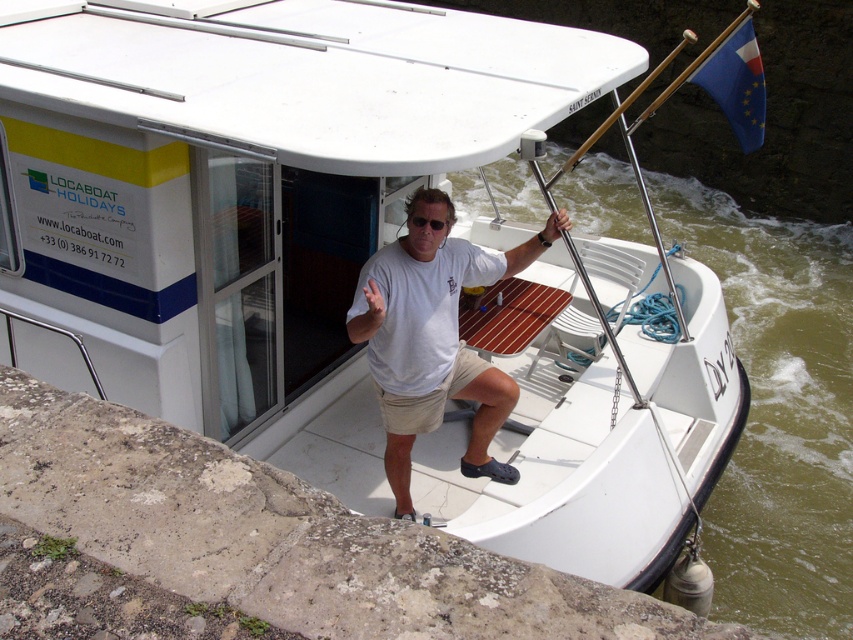
Between stone textured ledge at lower left and white cotton shirt at center, which one has more height?

With more height is white cotton shirt at center.

Can you confirm if stone textured ledge at lower left is positioned above white cotton shirt at center?

Actually, stone textured ledge at lower left is below white cotton shirt at center.

Is point (422, 625) positioned after point (364, 288)?

No, it is in front of (364, 288).

Locate an element on the screen. stone textured ledge at lower left is located at coordinates (280, 536).

Locate an element on the screen. The width and height of the screenshot is (853, 640). stone textured ledge at lower left is located at coordinates (280, 536).

This screenshot has height=640, width=853. Find the location of `stone textured ledge at lower left`. stone textured ledge at lower left is located at coordinates (280, 536).

You are a GUI agent. You are given a task and a screenshot of the screen. Output one action in this format:
    pyautogui.click(x=<x>, y=<y>)
    Task: Click on the stone textured ledge at lower left
    This screenshot has width=853, height=640.
    Given the screenshot: What is the action you would take?
    pyautogui.click(x=280, y=536)

Is green water at lower right to the left of white cotton shirt at center from the viewer's perspective?

No, green water at lower right is not to the left of white cotton shirt at center.

Does point (764, 269) lie in front of point (432, 368)?

No, it is behind (432, 368).

At what (x,y) coordinates should I click in order to perform the action: click on green water at lower right. Please return your answer as a coordinate pair (x, y). Image resolution: width=853 pixels, height=640 pixels. Looking at the image, I should click on (778, 410).

At what (x,y) coordinates should I click in order to perform the action: click on green water at lower right. Please return your answer as a coordinate pair (x, y). Looking at the image, I should click on (778, 410).